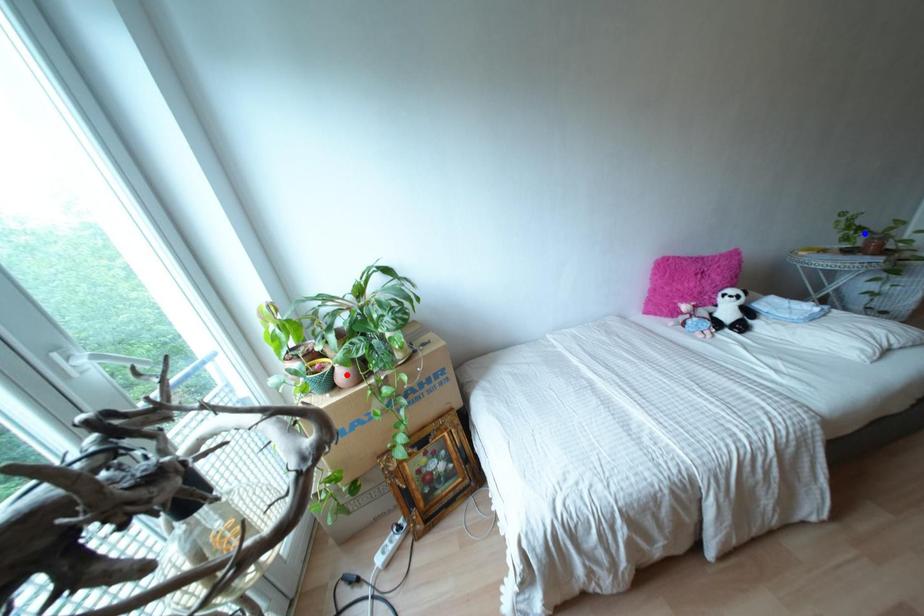
Question: In the image, two points are highlighted. Which point is nearer to the camera? Reply with the corresponding letter.

Choices:
 (A) blue point
 (B) red point

Answer: (B)